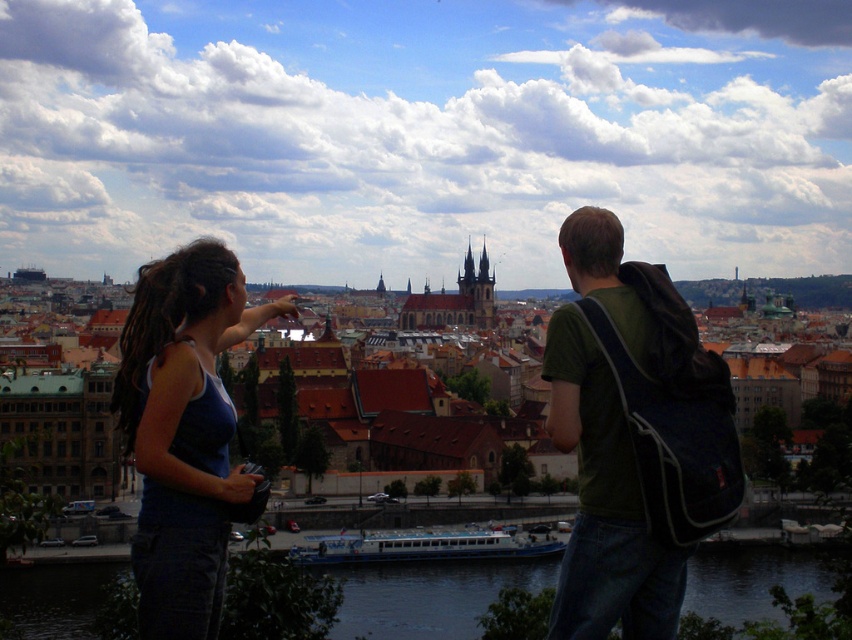
Question: Observing the image, what is the correct spatial positioning of matte blue tank top at center-left in reference to dark blue water at lower center?

Choices:
 (A) above
 (B) below

Answer: (A)

Question: Among these points, which one is nearest to the camera?

Choices:
 (A) (651, 385)
 (B) (655, 536)
 (C) (756, 595)
 (D) (150, 531)

Answer: (B)

Question: Is matte black backpack at center closer to camera compared to dark blue water at lower center?

Choices:
 (A) yes
 (B) no

Answer: (A)

Question: Which object appears farthest from the camera in this image?

Choices:
 (A) green fabric backpack at center
 (B) dark blue water at lower center
 (C) matte blue tank top at center-left
 (D) matte black backpack at center

Answer: (B)

Question: Which is nearer to the matte blue tank top at center-left?

Choices:
 (A) matte black backpack at center
 (B) green fabric backpack at center
 (C) dark blue water at lower center

Answer: (A)

Question: From the image, what is the correct spatial relationship of matte black backpack at center in relation to matte blue tank top at center-left?

Choices:
 (A) below
 (B) above

Answer: (A)